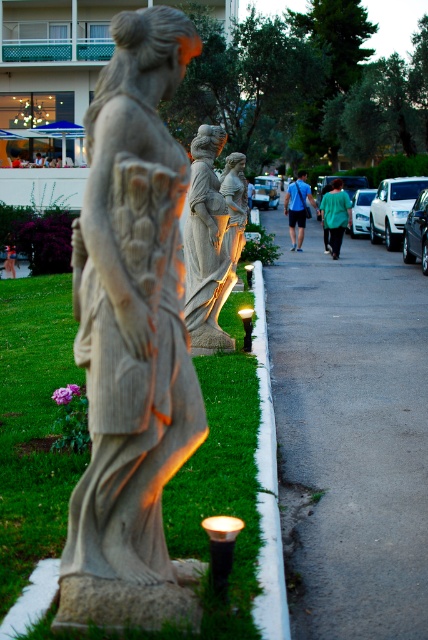
Question: Does gray asphalt pavement at center appear on the right side of green fabric shirt at center?

Choices:
 (A) yes
 (B) no

Answer: (B)

Question: Is white glossy car at right positioned before metallic silver car at right?

Choices:
 (A) yes
 (B) no

Answer: (B)

Question: Which object is closer to the camera taking this photo?

Choices:
 (A) metallic silver car at right
 (B) metallic silver car at center
 (C) stone statue at left
 (D) stone statue at center

Answer: (C)

Question: Estimate the real-world distances between objects in this image. Which object is farther from the metallic silver car at right?

Choices:
 (A) stone statue at left
 (B) blue fabric shirt at center
 (C) white glossy car at right

Answer: (A)

Question: Is green fabric shirt at center to the left of silver metallic car at center-right from the viewer's perspective?

Choices:
 (A) yes
 (B) no

Answer: (A)

Question: Which point is farther from the camera taking this photo?

Choices:
 (A) (80, 349)
 (B) (270, 195)
 (C) (374, 220)

Answer: (B)